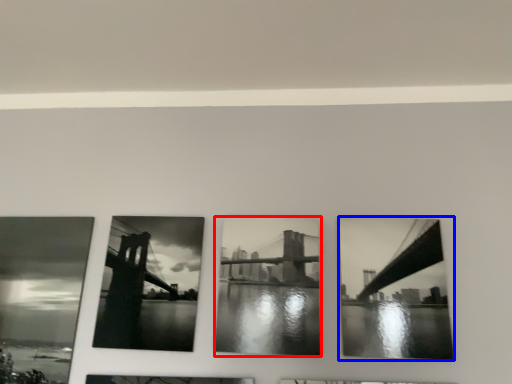
Question: Which object appears closest to the camera in this image, picture frame (highlighted by a red box) or picture frame (highlighted by a blue box)?

Choices:
 (A) picture frame
 (B) picture frame

Answer: (B)